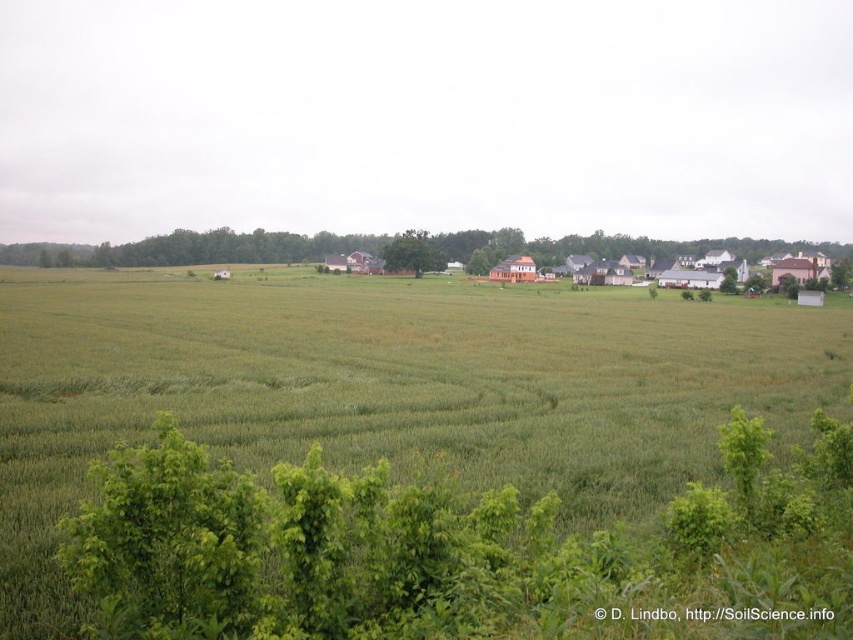
Question: Among these points, which one is farthest from the camera?

Choices:
 (A) (584, 451)
 (B) (247, 262)
 (C) (433, 243)

Answer: (B)

Question: Which object is positioned farthest from the green leafy tree at upper center?

Choices:
 (A) green leafy tree at center
 (B) green grassy field at center

Answer: (B)

Question: Where is green grassy field at center located in relation to green leafy tree at upper center in the image?

Choices:
 (A) left
 (B) right

Answer: (A)

Question: Does green leafy tree at upper center appear on the left side of green leafy tree at center?

Choices:
 (A) yes
 (B) no

Answer: (B)

Question: Can you confirm if green leafy tree at upper center is smaller than green leafy tree at center?

Choices:
 (A) yes
 (B) no

Answer: (B)

Question: Which point is closer to the camera?

Choices:
 (A) green leafy tree at center
 (B) green leafy tree at upper center
 (C) green grassy field at center

Answer: (C)